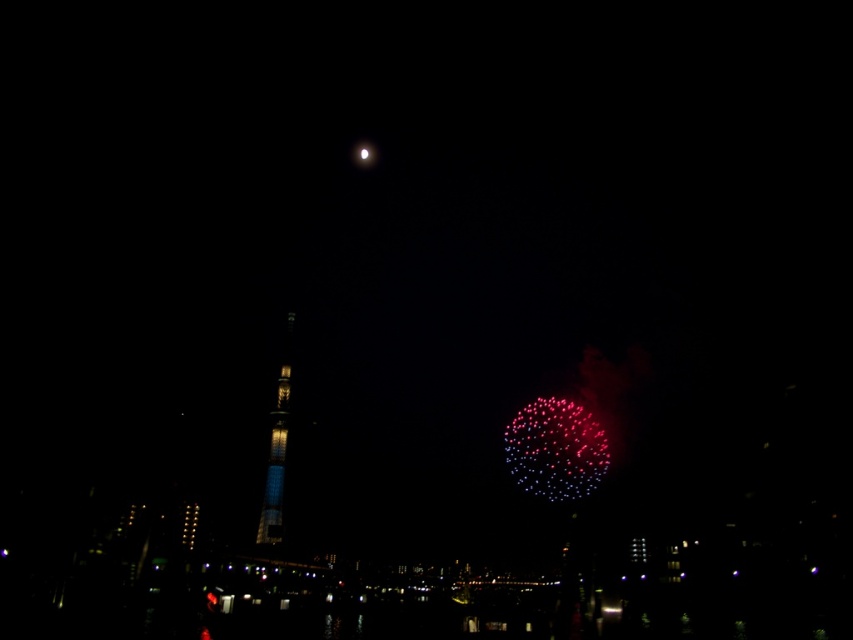
You are an astronomer observing the night sky. You notice the metallic silver moon at upper center and the shiny glass tower at center. Based on their positions, which object is located to the east?

The metallic silver moon at upper center is to the right of the shiny glass tower at center. Since the moon moves from east to west across the sky, the metallic silver moon at upper center is located to the east of the shiny glass tower at center.

You are an astronomer observing the night sky and notice the metallic silver moon at upper center and the shiny glass tower at center. Which object is positioned lower in the sky?

The metallic silver moon at upper center is positioned below the shiny glass tower at center, so it is lower in the sky.